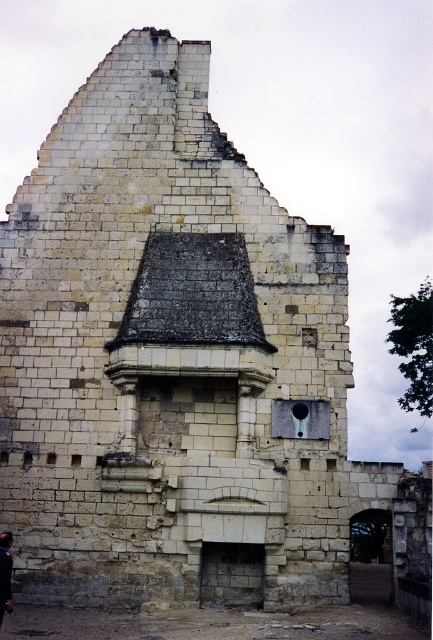
Question: Which object is closer to the camera taking this photo?

Choices:
 (A) black hair at upper center
 (B) smooth brown leather bag at lower left

Answer: (B)

Question: Is smooth brown leather bag at lower left below black hair at upper center?

Choices:
 (A) yes
 (B) no

Answer: (A)

Question: Does smooth brown leather bag at lower left appear over black hair at upper center?

Choices:
 (A) no
 (B) yes

Answer: (A)

Question: Can you confirm if smooth brown leather bag at lower left is positioned to the right of black hair at upper center?

Choices:
 (A) yes
 (B) no

Answer: (A)

Question: Which of the following is the farthest from the observer?

Choices:
 (A) (7, 541)
 (B) (12, 561)

Answer: (B)